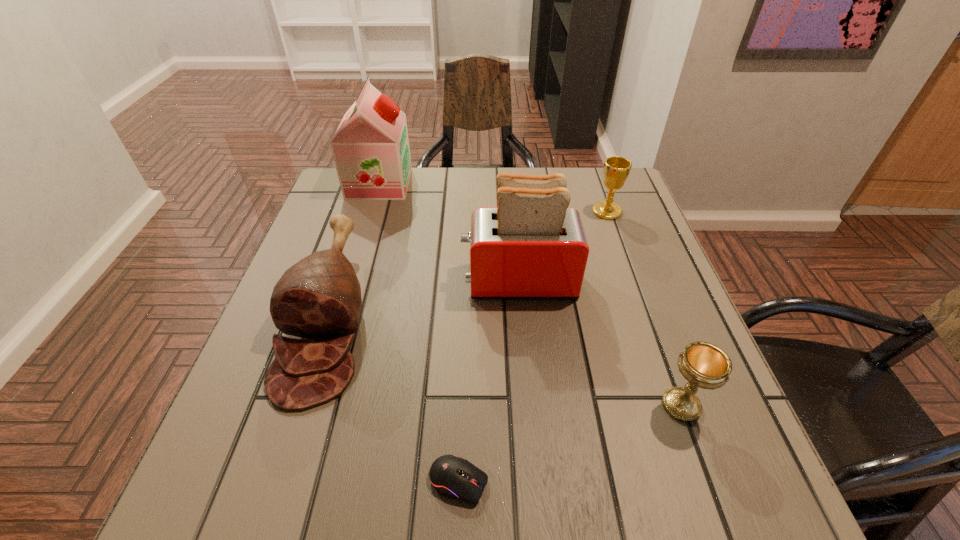
Locate an element on the screen. Image resolution: width=960 pixels, height=540 pixels. object at the far left corner is located at coordinates (370, 147).

This screenshot has height=540, width=960. I want to click on object situated at the far right corner, so click(x=616, y=169).

Identify the location of vacant region at the far edge of the desktop. (491, 167).

Image resolution: width=960 pixels, height=540 pixels. Find the location of `blank space at the left edge of the desktop`. blank space at the left edge of the desktop is located at coordinates (331, 238).

In order to click on free space at the right edge of the desktop in this screenshot , I will do `click(603, 271)`.

Where is `vacant space at the far left corner`? The width and height of the screenshot is (960, 540). vacant space at the far left corner is located at coordinates (340, 200).

This screenshot has width=960, height=540. Identify the location of free space that is in between the nearer chalice and the ham. (505, 360).

Where is `free point between the toaster and the computer mouse`? The image size is (960, 540). free point between the toaster and the computer mouse is located at coordinates 489,381.

The width and height of the screenshot is (960, 540). Find the location of `vacant space that's between the computer mouse and the nearer chalice`. vacant space that's between the computer mouse and the nearer chalice is located at coordinates (570, 443).

Find the location of a particular element. The height and width of the screenshot is (540, 960). free point between the ham and the toaster is located at coordinates (424, 298).